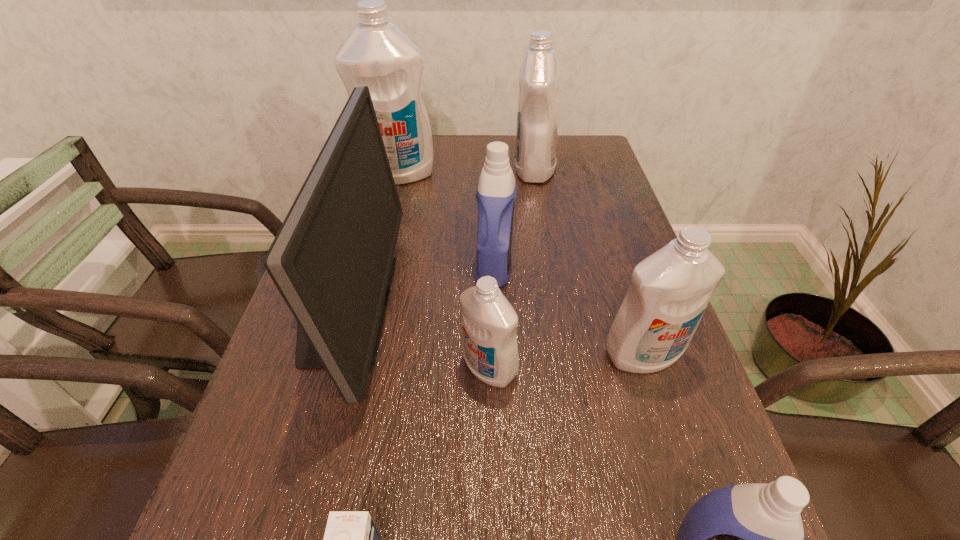
This screenshot has height=540, width=960. Identify the location of blank space located 0.100m on the left of the second tallest detergent. (480, 170).

The width and height of the screenshot is (960, 540). I want to click on vacant space located 0.300m on the screen side of the black computer monitor, so click(x=535, y=307).

You are a GUI agent. You are given a task and a screenshot of the screen. Output one action in this format:
    pyautogui.click(x=<x>, y=<y>)
    Task: Click on the vacant area situated 0.120m on the left of the third biggest white detergent
    The image size is (960, 540).
    Given the screenshot: What is the action you would take?
    pyautogui.click(x=540, y=354)

Image resolution: width=960 pixels, height=540 pixels. I want to click on vacant point located 0.240m on the right of the left blue detergent, so click(617, 266).

Where is `vacant region located 0.300m on the right of the smallest white detergent`? Image resolution: width=960 pixels, height=540 pixels. vacant region located 0.300m on the right of the smallest white detergent is located at coordinates (680, 368).

Where is `detergent that is at the left edge`? detergent that is at the left edge is located at coordinates (377, 54).

You are a GUI agent. You are given a task and a screenshot of the screen. Output one action in this format:
    pyautogui.click(x=<x>, y=<y>)
    Task: Click on the computer monitor that is at the left edge
    This screenshot has width=960, height=540.
    Given the screenshot: What is the action you would take?
    pyautogui.click(x=332, y=260)

Find the location of a particular element. The width and height of the screenshot is (960, 540). object that is at the far left corner is located at coordinates (377, 54).

You are a GUI agent. You are given a task and a screenshot of the screen. Output one action in this format:
    pyautogui.click(x=<x>, y=<y>)
    Task: Click on the object at the far right corner
    
    Given the screenshot: What is the action you would take?
    pyautogui.click(x=539, y=78)

Locate an element on the screen. The width and height of the screenshot is (960, 540). free location at the far edge is located at coordinates (481, 146).